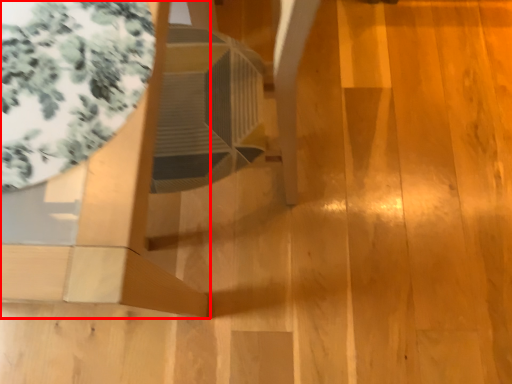
Question: From the image, what is the correct spatial relationship of furniture (annotated by the red box) in relation to glass table?

Choices:
 (A) left
 (B) right

Answer: (A)